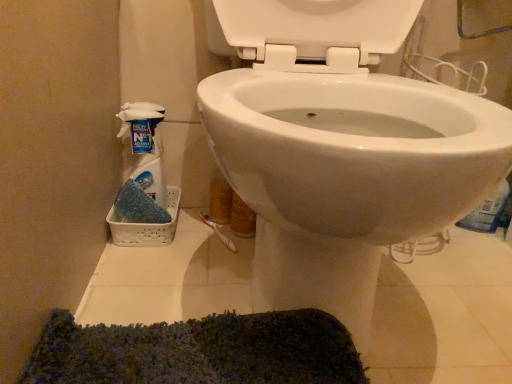
Question: Should I look upward or downward to see white glossy toilet at center?

Choices:
 (A) up
 (B) down

Answer: (A)

Question: Does white glossy toilet at center have a larger size compared to translucent plastic spray bottle at left?

Choices:
 (A) no
 (B) yes

Answer: (B)

Question: From the image's perspective, is white glossy toilet at center located beneath translucent plastic spray bottle at left?

Choices:
 (A) yes
 (B) no

Answer: (B)

Question: Is white glossy toilet at center positioned far away from translucent plastic spray bottle at left?

Choices:
 (A) yes
 (B) no

Answer: (B)

Question: Is white glossy toilet at center turned away from translucent plastic spray bottle at left?

Choices:
 (A) yes
 (B) no

Answer: (B)

Question: Is white glossy toilet at center oriented towards translucent plastic spray bottle at left?

Choices:
 (A) yes
 (B) no

Answer: (B)

Question: Is white glossy toilet at center taller than translucent plastic spray bottle at left?

Choices:
 (A) no
 (B) yes

Answer: (B)

Question: Is translucent plastic spray bottle at left further to camera compared to white glossy toilet at center?

Choices:
 (A) no
 (B) yes

Answer: (B)

Question: Considering the relative sizes of translucent plastic spray bottle at left and white glossy toilet at center in the image provided, is translucent plastic spray bottle at left taller than white glossy toilet at center?

Choices:
 (A) yes
 (B) no

Answer: (B)

Question: Can you confirm if translucent plastic spray bottle at left is positioned to the right of white glossy toilet at center?

Choices:
 (A) yes
 (B) no

Answer: (B)

Question: From the image's perspective, is translucent plastic spray bottle at left located above white glossy toilet at center?

Choices:
 (A) no
 (B) yes

Answer: (A)

Question: Can white glossy toilet at center be found inside translucent plastic spray bottle at left?

Choices:
 (A) yes
 (B) no

Answer: (B)

Question: Considering the relative positions of translucent plastic spray bottle at left and white glossy toilet at center in the image provided, is translucent plastic spray bottle at left to the left of white glossy toilet at center from the viewer's perspective?

Choices:
 (A) no
 (B) yes

Answer: (B)

Question: Is point tap(128, 125) closer or farther from the camera than point tap(374, 210)?

Choices:
 (A) farther
 (B) closer

Answer: (A)